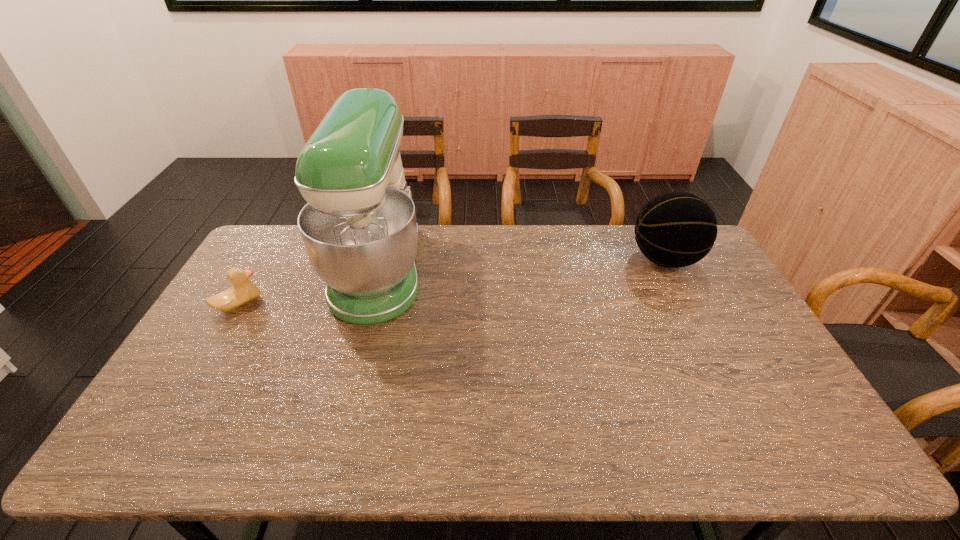
Locate an element on the screen. The width and height of the screenshot is (960, 540). mixer is located at coordinates (359, 229).

The height and width of the screenshot is (540, 960). Identify the location of the second object from right to left. (359, 229).

Identify the location of the second shortest object. The image size is (960, 540). (676, 229).

You are a GUI agent. You are given a task and a screenshot of the screen. Output one action in this format:
    pyautogui.click(x=<x>, y=<y>)
    Task: Click on the rightmost object
    
    Given the screenshot: What is the action you would take?
    pyautogui.click(x=676, y=229)

Locate an element on the screen. duck is located at coordinates (243, 291).

Where is `the shortest object`? Image resolution: width=960 pixels, height=540 pixels. the shortest object is located at coordinates (243, 291).

Where is `free space located on the controls of the mixer`? This screenshot has height=540, width=960. free space located on the controls of the mixer is located at coordinates (508, 271).

You are a GUI agent. You are given a task and a screenshot of the screen. Output one action in this format:
    pyautogui.click(x=<x>, y=<y>)
    Task: Click on the vacant area located 0.400m on the left of the second shortest object
    This screenshot has width=960, height=540.
    Given the screenshot: What is the action you would take?
    coord(516,260)

Where is `free space located 0.260m at the beak of the shortest object`? Image resolution: width=960 pixels, height=540 pixels. free space located 0.260m at the beak of the shortest object is located at coordinates (x=343, y=304).

Identify the location of mixer positioned at the far edge. (359, 229).